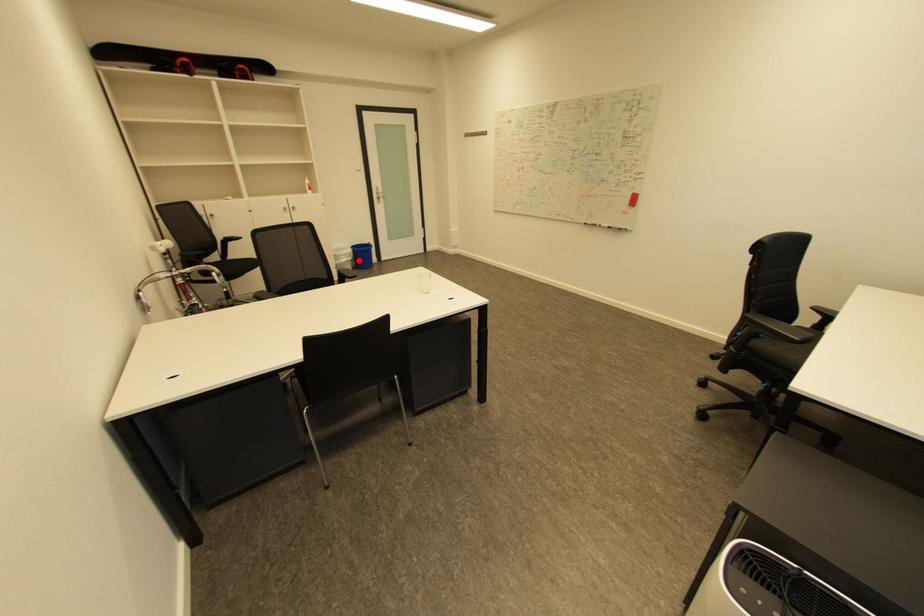
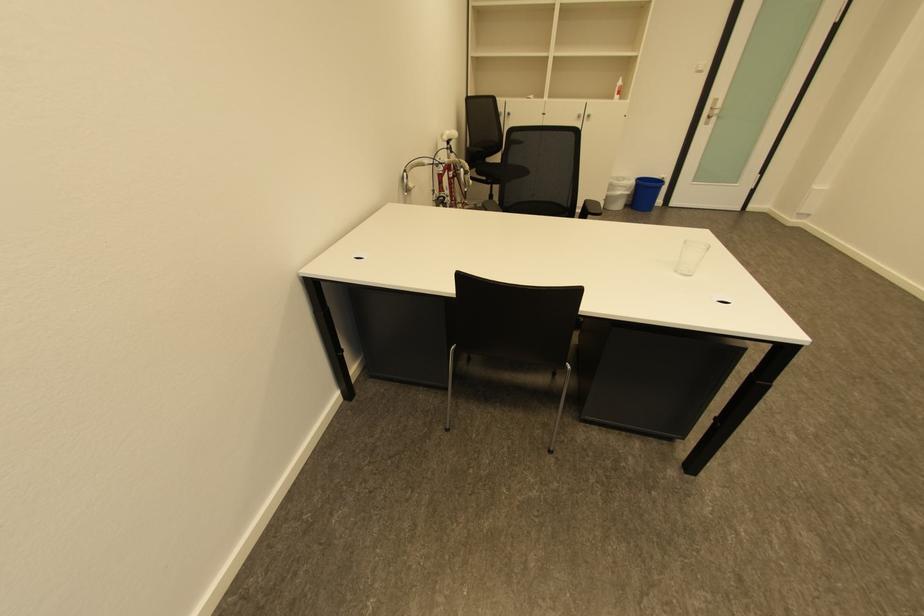
Question: I am providing you with two images of the same scene from different viewpoints. Given a red point in image1, look at the same physical point in image2. Is it:

Choices:
 (A) Closer to the viewpoint
 (B) Farther from the viewpoint

Answer: (B)